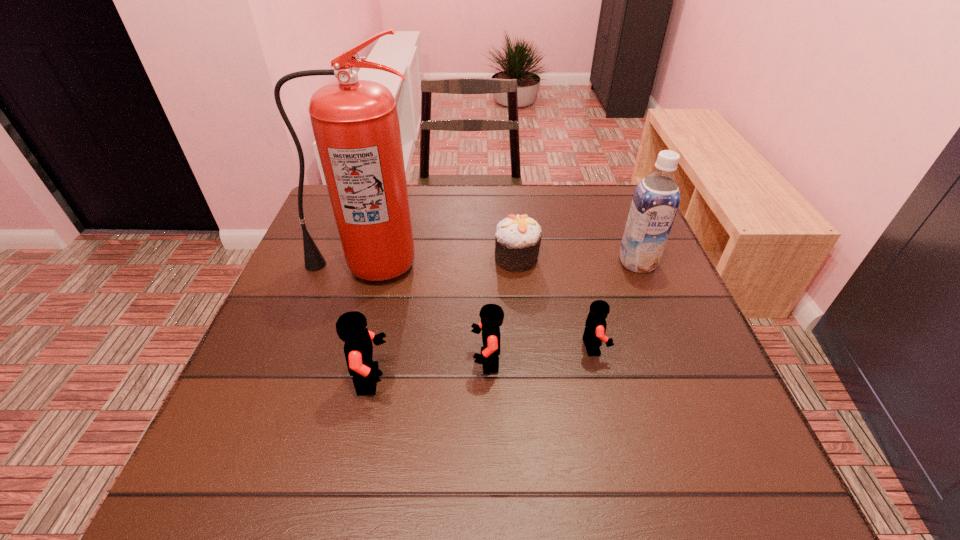
Image resolution: width=960 pixels, height=540 pixels. I want to click on the leftmost Lego, so tap(351, 327).

Locate an element on the screen. the second shortest Lego is located at coordinates (492, 315).

Identify the location of the third shortest object. The height and width of the screenshot is (540, 960). (492, 315).

Where is `the shortest Lego`? the shortest Lego is located at coordinates (595, 326).

I want to click on the second object from right to left, so click(595, 326).

The width and height of the screenshot is (960, 540). Identify the location of fire extinguisher. 355,123.

I want to click on soya milk, so click(656, 199).

This screenshot has height=540, width=960. In order to click on the fifth shortest object in this screenshot , I will do `click(656, 199)`.

This screenshot has width=960, height=540. I want to click on cupcake, so click(x=517, y=238).

Identify the location of vacant space positioned on the front-facing side of the leftmost Lego. (459, 379).